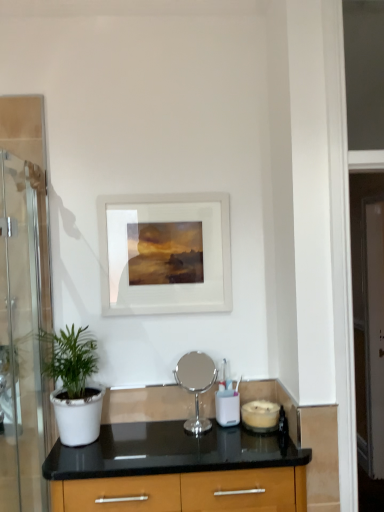
Question: Is silver metallic mirror at center, the first appliance in the left-to-right sequence, smaller than green matte plant at left?

Choices:
 (A) no
 (B) yes

Answer: (B)

Question: From a real-world perspective, is silver metallic mirror at center, marked as the second appliance in a right-to-left arrangement, under green matte plant at left?

Choices:
 (A) no
 (B) yes

Answer: (B)

Question: Would you say silver metallic mirror at center, the first appliance in the left-to-right sequence, is outside green matte plant at left?

Choices:
 (A) yes
 (B) no

Answer: (A)

Question: From a real-world perspective, does silver metallic mirror at center, marked as the second appliance in a right-to-left arrangement, stand above green matte plant at left?

Choices:
 (A) no
 (B) yes

Answer: (A)

Question: Does silver metallic mirror at center, the first appliance in the left-to-right sequence, have a greater height compared to green matte plant at left?

Choices:
 (A) yes
 (B) no

Answer: (B)

Question: Is silver metallic mirror at center, the first appliance in the left-to-right sequence, bigger than green matte plant at left?

Choices:
 (A) yes
 (B) no

Answer: (B)

Question: Is transparent glass screen door at left, the second screen door viewed from the back, looking in the opposite direction of matte glass candle at lower right, the first appliance when ordered from right to left?

Choices:
 (A) no
 (B) yes

Answer: (A)

Question: Is transparent glass screen door at left, acting as the 1th screen door starting from the front, oriented towards matte glass candle at lower right, the 2th appliance positioned from the left?

Choices:
 (A) no
 (B) yes

Answer: (B)

Question: Does transparent glass screen door at left, the second screen door viewed from the back, have a larger size compared to matte glass candle at lower right, the 2th appliance positioned from the left?

Choices:
 (A) no
 (B) yes

Answer: (B)

Question: Is the depth of transparent glass screen door at left, placed as the first screen door when sorted from left to right, greater than that of matte glass candle at lower right, the 2th appliance positioned from the left?

Choices:
 (A) no
 (B) yes

Answer: (A)

Question: Does transparent glass screen door at left, placed as the first screen door when sorted from left to right, touch matte glass candle at lower right, the 2th appliance positioned from the left?

Choices:
 (A) yes
 (B) no

Answer: (B)

Question: Can you confirm if transparent glass screen door at left, acting as the 1th screen door starting from the front, is smaller than matte glass candle at lower right, the first appliance when ordered from right to left?

Choices:
 (A) yes
 (B) no

Answer: (B)

Question: Considering the relative sizes of silver metallic mirror at center, the first appliance in the left-to-right sequence, and transparent glass screen door at left, acting as the 1th screen door starting from the front, in the image provided, is silver metallic mirror at center, the first appliance in the left-to-right sequence, wider than transparent glass screen door at left, acting as the 1th screen door starting from the front,?

Choices:
 (A) yes
 (B) no

Answer: (B)